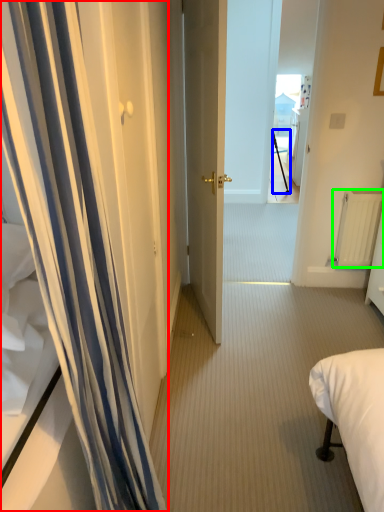
Question: Considering the real-world distances, which object is closest to curtain (highlighted by a red box)? tripod (highlighted by a blue box) or radiator (highlighted by a green box).

Choices:
 (A) tripod
 (B) radiator

Answer: (B)